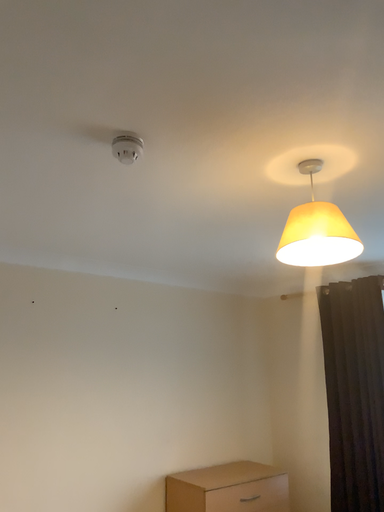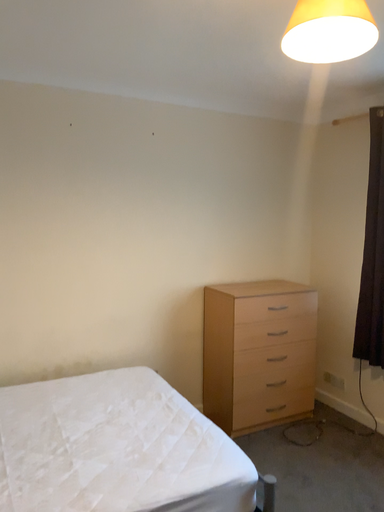
Question: Which way did the camera rotate in the video?

Choices:
 (A) rotated right
 (B) rotated left

Answer: (B)